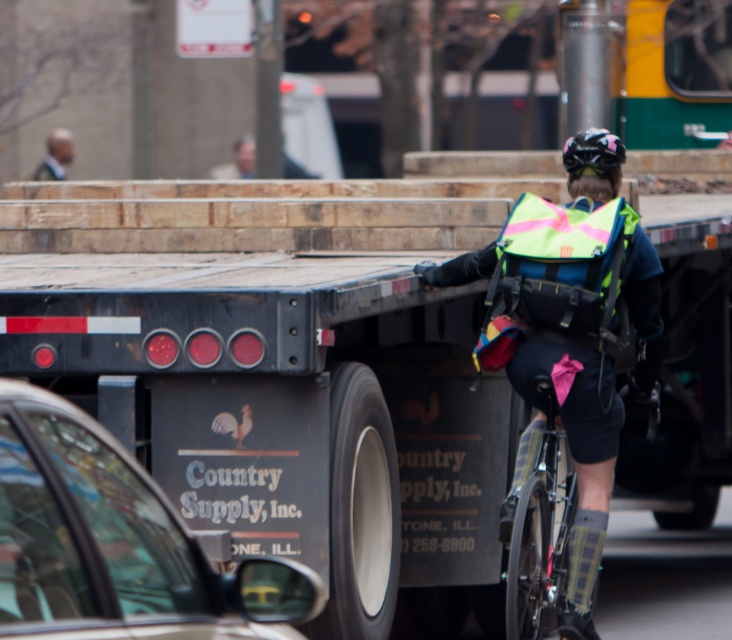
Question: Is the position of matte black trailer truck at center more distant than that of light brown hair at upper left?

Choices:
 (A) yes
 (B) no

Answer: (B)

Question: Which of these objects is positioned closest to the matte black trailer truck at center?

Choices:
 (A) shiny black frame at center
 (B) shiny black helmet at upper center
 (C) neon reflective safety vest at center

Answer: (A)

Question: Among these points, which one is farthest from the camera?

Choices:
 (A) (53, 163)
 (B) (556, 220)

Answer: (A)

Question: Which of the following is the closest to the observer?

Choices:
 (A) (559, 444)
 (B) (631, 218)
 (C) (619, 150)

Answer: (B)

Question: Where is neon reflective vest at center located in relation to shiny black helmet at upper center in the image?

Choices:
 (A) left
 (B) right

Answer: (A)

Question: Is black matte truck at lower left above light brown hair at upper left?

Choices:
 (A) no
 (B) yes

Answer: (A)